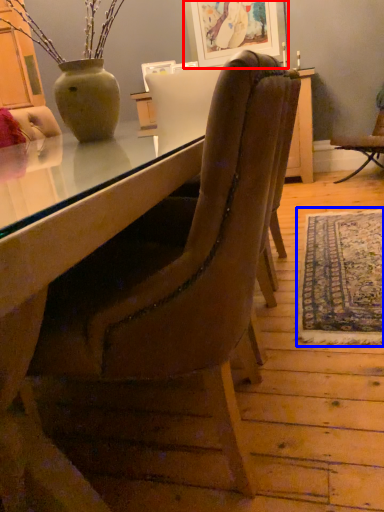
Question: Which object appears farthest to the camera in this image, picture frame (highlighted by a red box) or mat (highlighted by a blue box)?

Choices:
 (A) picture frame
 (B) mat

Answer: (A)